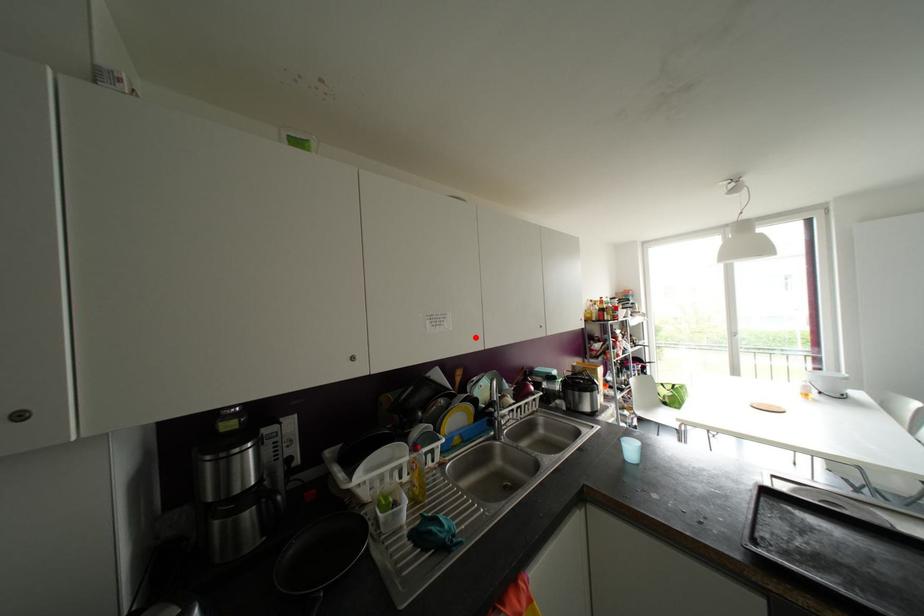
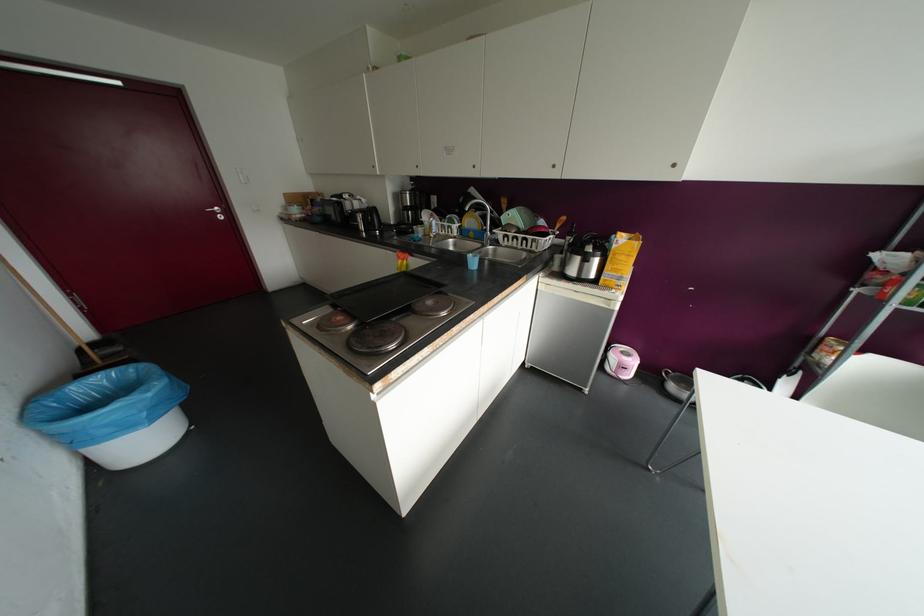
Question: I am providing you with two images of the same scene from different viewpoints. Image1 has a red point marked. In image2, the corresponding 3D location appears at what relative position? Reply with the corresponding letter.

Choices:
 (A) Closer
 (B) Farther

Answer: (A)